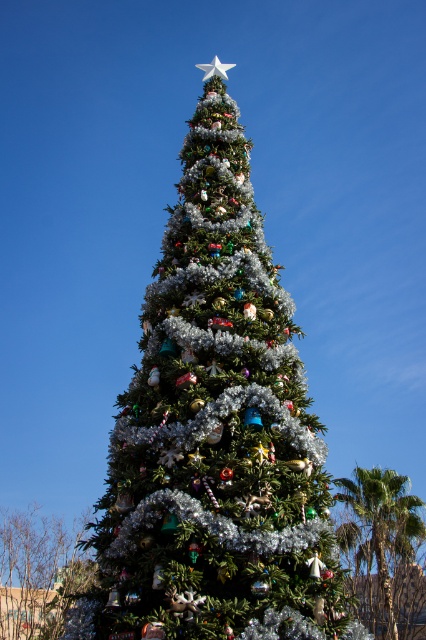
You are standing in a room with a green shiny christmas tree at lower left. You want to place a new ornament on the tree. Where should you go to reach the tree?

The green shiny christmas tree at lower left is located at position point (39, 572), so you should go to that coordinate to reach the tree.

You are planning to place a new decoration on the tree. Given the sizes of the green shiny christmas tree at lower left and the green leafy palm at lower right, which tree would allow you to hang a larger ornament without overcrowding?

The green shiny christmas tree at lower left is larger in size than the green leafy palm at lower right, so it can accommodate larger ornaments without overcrowding.